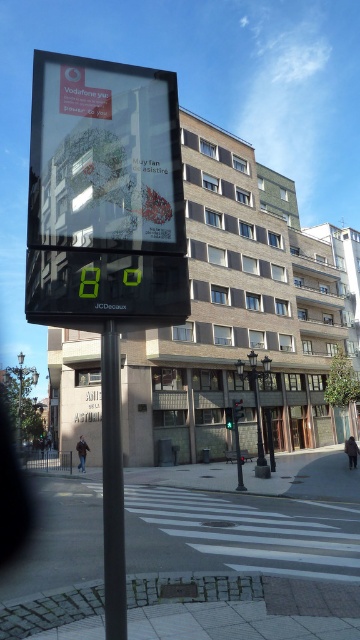
Question: Is transparent glass billboard at center bigger than black metal pole at center?

Choices:
 (A) yes
 (B) no

Answer: (A)

Question: Observing the image, what is the correct spatial positioning of transparent glass billboard at center in reference to black metal pole at center?

Choices:
 (A) below
 (B) above

Answer: (B)

Question: Is transparent glass billboard at center closer to camera compared to black metal pole at center?

Choices:
 (A) yes
 (B) no

Answer: (B)

Question: Which of the following is the closest to the observer?

Choices:
 (A) (177, 140)
 (B) (109, 595)

Answer: (B)

Question: Which of the following is the closest to the observer?

Choices:
 (A) transparent glass billboard at center
 (B) black metal pole at center

Answer: (B)